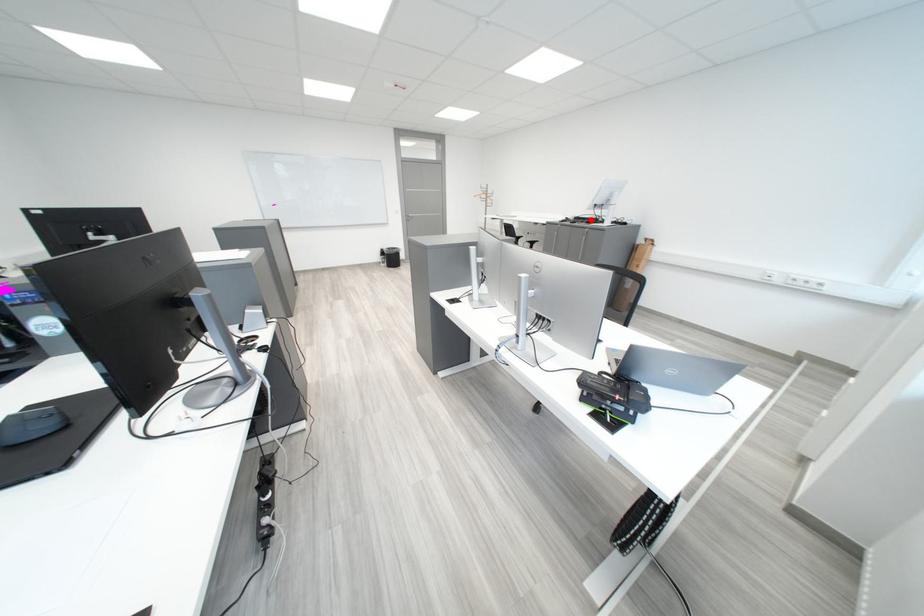
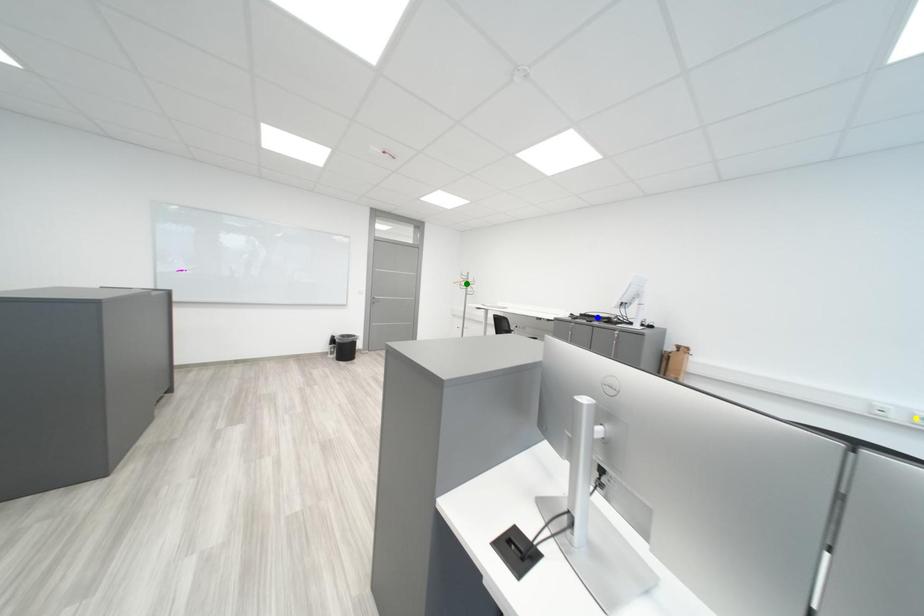
Question: I am providing you with two images of the same scene from different viewpoints. A red point is marked on the first image. You are given multiple points on the second image. In image 2, which mark is for the same physical point as the one in image 1?

Choices:
 (A) yellow point
 (B) green point
 (C) blue point

Answer: (C)